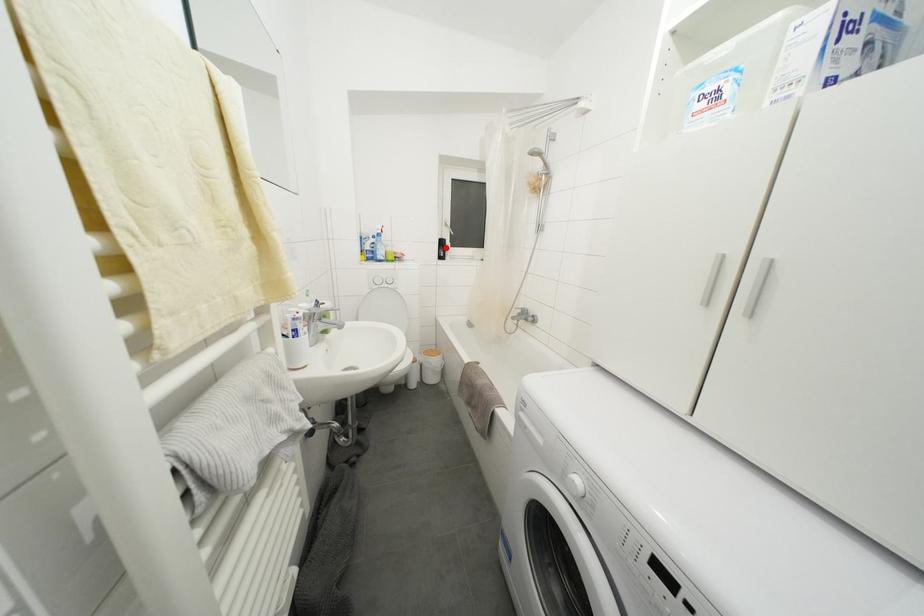
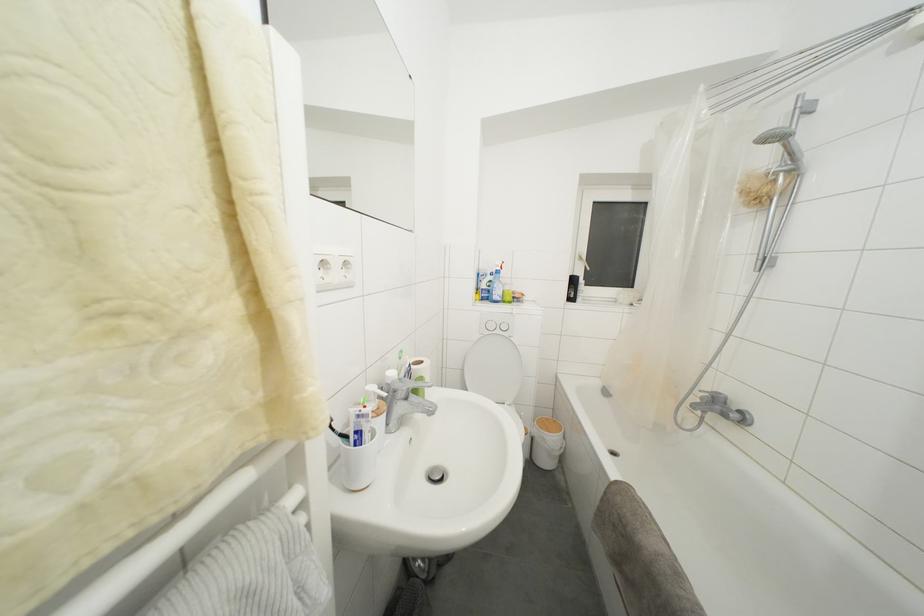
Question: I am providing you with two images of the same scene from different viewpoints. A red point is marked on the first image. At the location where the point appears in image 1, is it still visible in image 2?

Choices:
 (A) Yes
 (B) No

Answer: (A)